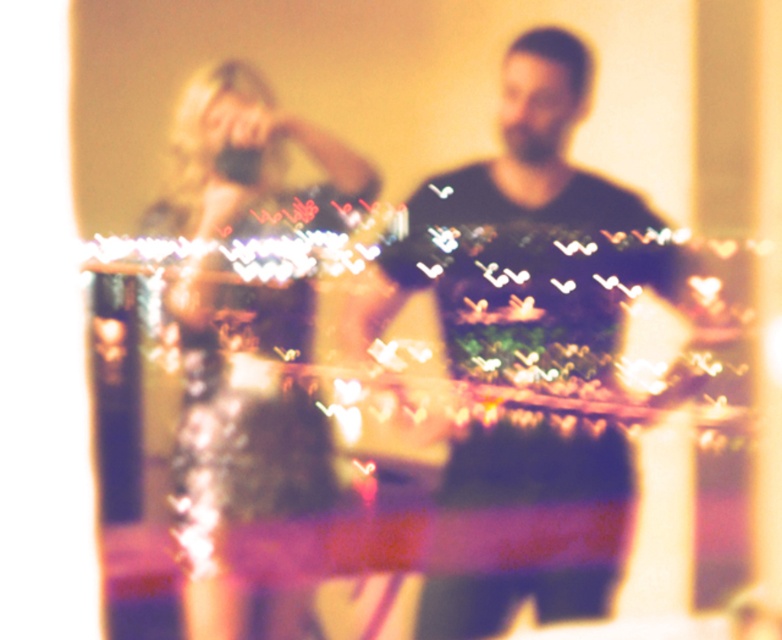
You are a fashion designer who wants to create a matching outfit using the dark green sweater at center and the shiny silver dress at center. Which item should you choose as the base for the outfit to ensure it accommodates the other piece appropriately?

The dark green sweater at center has a larger size compared to the shiny silver dress at center, so it should be chosen as the base to ensure the outfit accommodates the smaller shiny silver dress at center appropriately.

You are a fashion designer analyzing a blurred image of two people reflected in a mirror. The image shows a dark green sweater at center and a shiny silver dress at center. Based on the reflection, which clothing item appears taller in the image?

The dark green sweater at center appears taller than the shiny silver dress at center in the reflection.